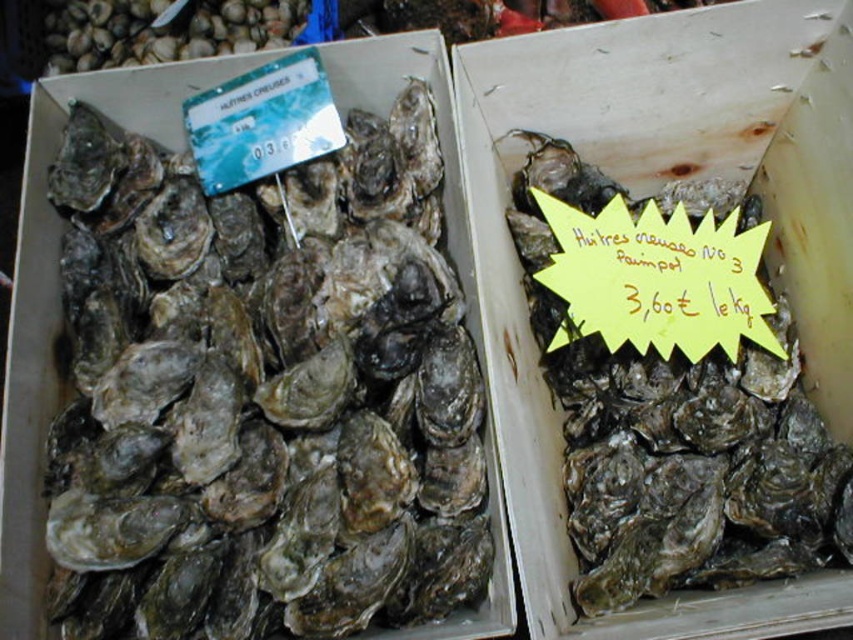
Question: Does matte gray oyster at left have a smaller size compared to dark gray textured oyster at right?

Choices:
 (A) no
 (B) yes

Answer: (A)

Question: Is matte gray oyster at left positioned at the back of dark gray textured oyster at right?

Choices:
 (A) yes
 (B) no

Answer: (B)

Question: In this image, where is matte gray oyster at left located relative to dark gray textured oyster at right?

Choices:
 (A) below
 (B) above

Answer: (B)

Question: Which object appears closest to the camera in this image?

Choices:
 (A) dark gray textured oyster at right
 (B) matte gray oyster at left

Answer: (B)